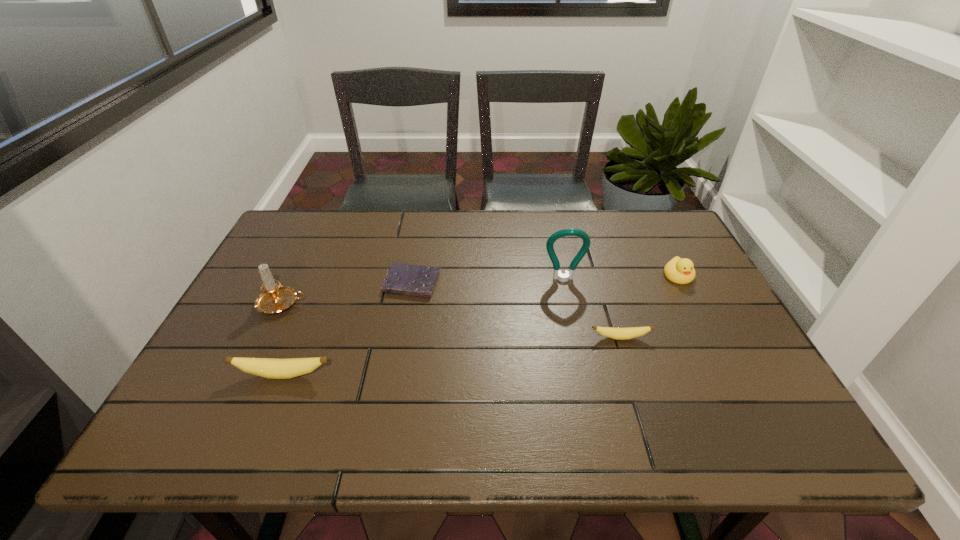
Identify the location of unoccupied position between the fourth object from right to left and the second nearest object. The width and height of the screenshot is (960, 540). (516, 310).

Where is `vacant point located between the duckling and the tallest object`? This screenshot has height=540, width=960. vacant point located between the duckling and the tallest object is located at coordinates (621, 278).

Identify the location of free space between the shortest object and the duckling. (545, 280).

Locate an element on the screen. vacant region between the nearer banana and the candle is located at coordinates (283, 340).

Where is `vacant region between the second nearest object and the candle`? The height and width of the screenshot is (540, 960). vacant region between the second nearest object and the candle is located at coordinates (451, 321).

The height and width of the screenshot is (540, 960). I want to click on free space between the rightmost object and the taller banana, so tap(481, 326).

At what (x,y) coordinates should I click in order to perform the action: click on vacant space in between the rightmost object and the fifth farthest object. Please return your answer as a coordinate pair (x, y). Looking at the image, I should click on (649, 307).

What are the coordinates of `object that is the fourth closest to the fourth object from right to left` in the screenshot? It's located at (628, 333).

Choose which object is the third nearest neighbor to the second shortest object. Please provide its 2D coordinates. Your answer should be formatted as a tuple, i.e. [(x, y)], where the tuple contains the x and y coordinates of a point satisfying the conditions above.

[(403, 279)]

You are a GUI agent. You are given a task and a screenshot of the screen. Output one action in this format:
    pyautogui.click(x=<x>, y=<y>)
    Task: Click on the vacant area that satisfies the following two spatial constraints: 1. on the back side of the right banana; 2. on the left side of the left banana
    The width and height of the screenshot is (960, 540).
    Given the screenshot: What is the action you would take?
    pyautogui.click(x=299, y=338)